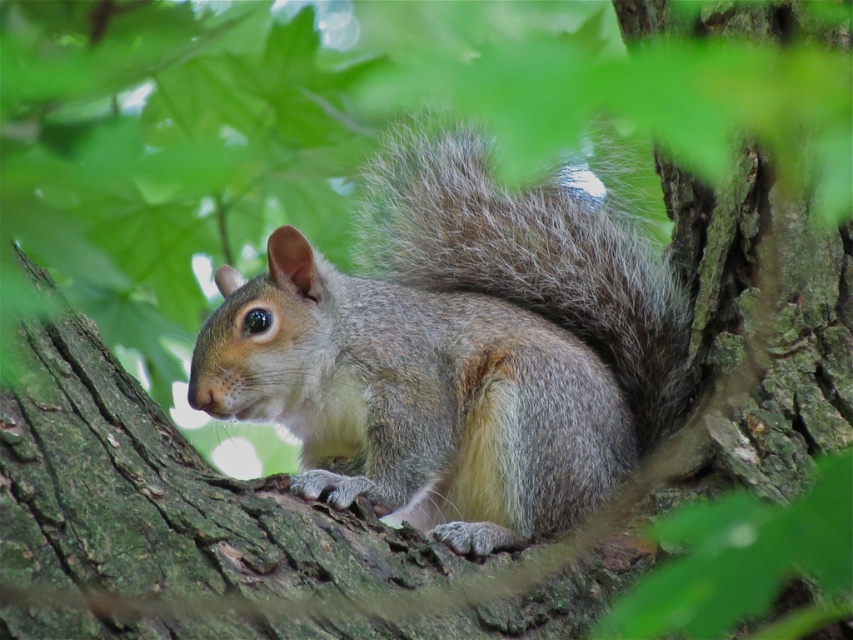
You are a photographer trying to capture the squirrel in the image. You notice two points marked in the scene. The first point is at coordinate point [380,170], and the second is at point [67,486]. Which point is closer to the camera?

Point [380,170] is further to the camera than point [67,486], so the second point is closer to the camera.

You are a bird flying above the scene. You notice the gray fur squirrel at center and the brown rough tree trunk at center. Which object is taller from your perspective?

The gray fur squirrel at center is taller than the brown rough tree trunk at center.

You are observing a squirrel in a forest. You see the gray fur squirrel at center and the brown rough tree trunk at center. Which object is positioned to the right side?

The gray fur squirrel at center is positioned to the right of the brown rough tree trunk at center.